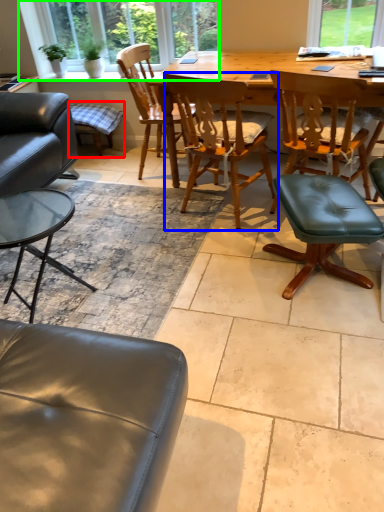
Question: Which is farther away from bar stool (highlighted by a red box)? chair (highlighted by a blue box) or window frame (highlighted by a green box)?

Choices:
 (A) chair
 (B) window frame

Answer: (A)